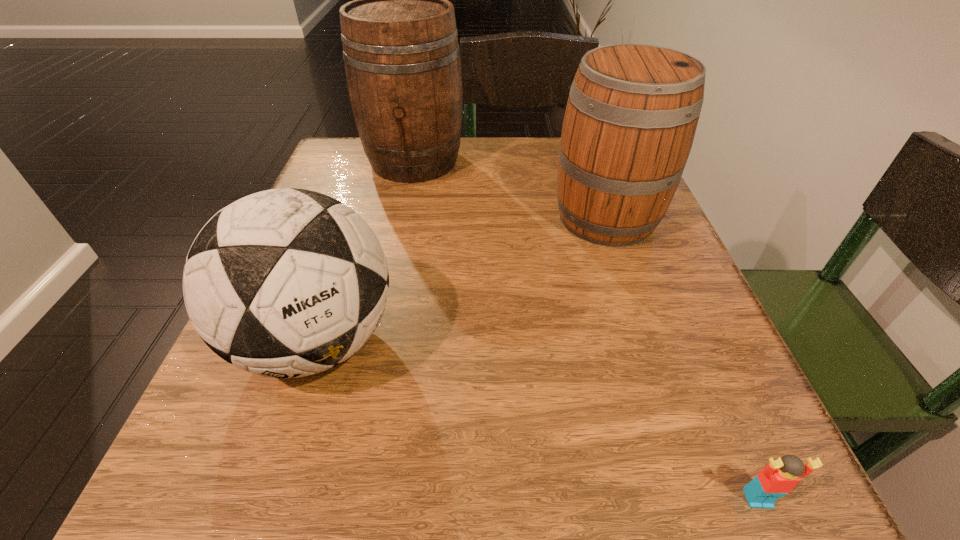
Where is `cider that is at the left edge`? This screenshot has width=960, height=540. cider that is at the left edge is located at coordinates (402, 62).

Locate an element on the screen. This screenshot has width=960, height=540. soccer ball that is positioned at the left edge is located at coordinates (284, 283).

I want to click on cider at the right edge, so click(x=632, y=112).

In order to click on Lego present at the right edge in this screenshot , I will do `click(778, 478)`.

Where is `object located in the far left corner section of the desktop`? object located in the far left corner section of the desktop is located at coordinates (402, 62).

In order to click on object at the far right corner in this screenshot , I will do `click(632, 112)`.

The image size is (960, 540). Identify the location of object located at the near right corner. (778, 478).

Identify the location of vacant space at the far edge of the desktop. (422, 195).

Image resolution: width=960 pixels, height=540 pixels. In order to click on vacant space at the near edge in this screenshot , I will do `click(468, 470)`.

In the image, there is a desktop. What are the coordinates of `vacant area at the left edge` in the screenshot? It's located at (340, 387).